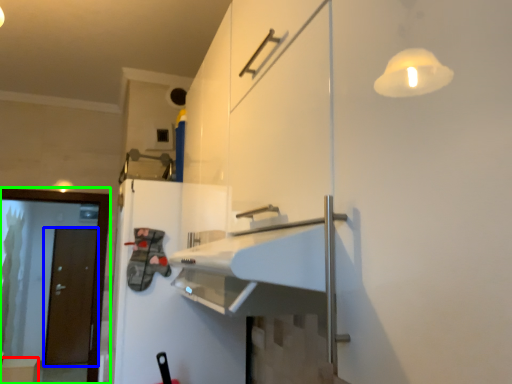
Question: Estimate the real-world distances between objects in this image. Which object is closer to cabinetry (highlighted by a red box), door (highlighted by a blue box) or screen door (highlighted by a green box)?

Choices:
 (A) door
 (B) screen door

Answer: (A)